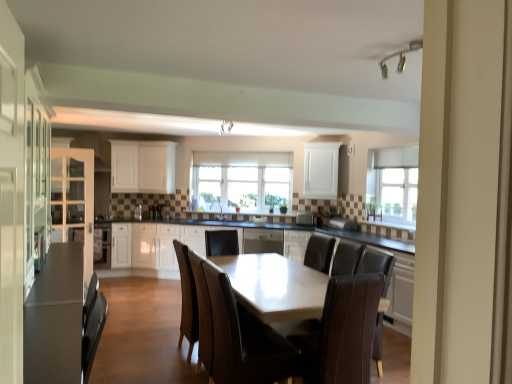
The height and width of the screenshot is (384, 512). What do you see at coordinates (124, 166) in the screenshot? I see `white matte cabinet at center, acting as the 4th cabinetry starting from the right` at bounding box center [124, 166].

What is the approximate width of white glossy cabinet at center, placed as the 2th cabinetry when sorted from right to left?

It is 24.98 inches.

The image size is (512, 384). What do you see at coordinates (228, 328) in the screenshot? I see `matte white table at center` at bounding box center [228, 328].

Measure the distance between matte white table at center and camera.

The distance of matte white table at center from camera is 2.64 meters.

Describe the element at coordinates (305, 219) in the screenshot. I see `matte gray armchair at center` at that location.

This screenshot has height=384, width=512. Describe the element at coordinates (163, 211) in the screenshot. I see `satin silver toaster at center, the first appliance in the right-to-left sequence` at that location.

This screenshot has height=384, width=512. In order to click on white matte cabinet at upper center, the 5th cabinetry positioned from the left in this screenshot , I will do `click(321, 170)`.

From the picture: How different are the orientations of clear glass window at center, arranged as the first window when viewed from the left, and matte gray armchair at center in degrees?

clear glass window at center, arranged as the first window when viewed from the left, and matte gray armchair at center are facing 3.33 degrees away from each other.

Could you tell me if clear glass window at center, acting as the first window starting from the back, is facing matte gray armchair at center?

No, clear glass window at center, acting as the first window starting from the back, is not aimed at matte gray armchair at center.

Which of these two, clear glass window at center, the 2th window in the right-to-left sequence, or matte gray armchair at center, is wider?

matte gray armchair at center.

Which of these two, clear glass window at center, acting as the first window starting from the back, or matte gray armchair at center, is bigger?

With larger size is clear glass window at center, acting as the first window starting from the back.

In the scene shown: From a real-world perspective, is matte gray armchair at center beneath clear glass window at upper center, the second window in the back-to-front sequence?

Yes, from a real-world perspective, matte gray armchair at center is below clear glass window at upper center, the second window in the back-to-front sequence.

From the picture: Are matte gray armchair at center and clear glass window at upper center, which ranks as the first window in right-to-left order, located far from each other?

That's right, there is a large distance between matte gray armchair at center and clear glass window at upper center, which ranks as the first window in right-to-left order.

Which object is positioned more to the left, matte gray armchair at center or clear glass window at upper center, the first window viewed from the front?

Positioned to the left is matte gray armchair at center.

In terms of size, does matte gray armchair at center appear bigger or smaller than clear glass window at upper center, which is counted as the 2th window, starting from the left?

Considering their sizes, matte gray armchair at center takes up less space than clear glass window at upper center, which is counted as the 2th window, starting from the left.

Based on their sizes in the image, would you say white matte cabinet at center, acting as the 4th cabinetry starting from the right, is bigger or smaller than brown leather chair at center, positioned as the 2th chair in left-to-right order?

white matte cabinet at center, acting as the 4th cabinetry starting from the right, is smaller than brown leather chair at center, positioned as the 2th chair in left-to-right order.

Is white matte cabinet at center, acting as the 4th cabinetry starting from the right, wider than brown leather chair at center, positioned as the 2th chair in left-to-right order?

In fact, white matte cabinet at center, acting as the 4th cabinetry starting from the right, might be narrower than brown leather chair at center, positioned as the 2th chair in left-to-right order.

Looking at this image, which point is more forward, (125, 156) or (329, 352)?

Positioned in front is point (329, 352).

From the picture: Is satin silver dishwasher at center wider than white glossy cabinet at center, the 4th cabinetry from the left?

Yes.

Where is `dish washer located behind the white glossy cabinet at center, the 4th cabinetry from the left`? Image resolution: width=512 pixels, height=384 pixels. dish washer located behind the white glossy cabinet at center, the 4th cabinetry from the left is located at coordinates (263, 241).

In the image, is satin silver dishwasher at center positioned in front of or behind white glossy cabinet at center, the 4th cabinetry from the left?

Visually, satin silver dishwasher at center is located behind white glossy cabinet at center, the 4th cabinetry from the left.

Can you confirm if satin silver dishwasher at center is smaller than white glossy cabinet at center, placed as the 2th cabinetry when sorted from right to left?

Actually, satin silver dishwasher at center might be larger than white glossy cabinet at center, placed as the 2th cabinetry when sorted from right to left.

Is white glossy cabinet at center, placed as the 2th cabinetry when sorted from right to left, turned away from matte white cabinet at left, the first cabinetry from the left?

No, matte white cabinet at left, the first cabinetry from the left, is not at the back of white glossy cabinet at center, placed as the 2th cabinetry when sorted from right to left.

Relative to matte white cabinet at left, marked as the 5th cabinetry in a right-to-left arrangement, is white glossy cabinet at center, placed as the 2th cabinetry when sorted from right to left, in front or behind?

white glossy cabinet at center, placed as the 2th cabinetry when sorted from right to left, is positioned farther from the viewer than matte white cabinet at left, marked as the 5th cabinetry in a right-to-left arrangement.

From a real-world perspective, relative to matte white cabinet at left, the first cabinetry from the left, is white glossy cabinet at center, placed as the 2th cabinetry when sorted from right to left, vertically above or below?

Clearly, from a real-world perspective, white glossy cabinet at center, placed as the 2th cabinetry when sorted from right to left, is below matte white cabinet at left, the first cabinetry from the left.

Where is `cabinetry below the matte white cabinet at left, the first cabinetry from the left (from the image's perspective)`? The image size is (512, 384). cabinetry below the matte white cabinet at left, the first cabinetry from the left (from the image's perspective) is located at coordinates (296, 244).

Where is `the 2nd appliance behind the clear glass window at center, the 2th window in the right-to-left sequence`? This screenshot has width=512, height=384. the 2nd appliance behind the clear glass window at center, the 2th window in the right-to-left sequence is located at coordinates (163, 211).

Is point (268, 206) positioned behind point (168, 214)?

That is True.

Is clear glass window at center, the 2th window in the right-to-left sequence, next to satin silver toaster at center, which is the 2th appliance in left-to-right order, and touching it?

No.

Does clear glass window at center, acting as the first window starting from the back, turn towards satin silver toaster at center, which is the 2th appliance in left-to-right order?

No, clear glass window at center, acting as the first window starting from the back, is not oriented towards satin silver toaster at center, which is the 2th appliance in left-to-right order.

Would you say white matte cabinet at upper center, which is the third cabinetry from right to left, is inside or outside white matte cabinet at upper center, the first cabinetry in the right-to-left sequence?

white matte cabinet at upper center, which is the third cabinetry from right to left, is located beyond the bounds of white matte cabinet at upper center, the first cabinetry in the right-to-left sequence.

Which object is further away from the camera, white matte cabinet at upper center, which is the third cabinetry from right to left, or white matte cabinet at upper center, the first cabinetry in the right-to-left sequence?

white matte cabinet at upper center, which is the third cabinetry from right to left, is further from the camera.

Considering the relative positions of white matte cabinet at upper center, which is the third cabinetry from right to left, and white matte cabinet at upper center, the 5th cabinetry positioned from the left, in the image provided, is white matte cabinet at upper center, which is the third cabinetry from right to left, to the left or to the right of white matte cabinet at upper center, the 5th cabinetry positioned from the left,?

Clearly, white matte cabinet at upper center, which is the third cabinetry from right to left, is on the left of white matte cabinet at upper center, the 5th cabinetry positioned from the left, in the image.

The image size is (512, 384). I want to click on window located on the left of matte gray armchair at center, so click(x=242, y=180).

From the image's perspective, starting from the matte gray armchair at center, which window is the 2nd one above? Please provide its 2D coordinates.

[(392, 185)]

Considering their positions, is white matte cabinet at center, acting as the 4th cabinetry starting from the right, positioned further to matte gray armchair at center than satin silver dishwasher at center?

Based on the image, white matte cabinet at center, acting as the 4th cabinetry starting from the right, appears to be further to matte gray armchair at center.

Considering their positions, is matte white cabinet at left, the first cabinetry from the left, positioned closer to satin silver toaster at center, which is the 2th appliance in left-to-right order, than brown leather chair at center, which is the 1th chair in right-to-left order?

The object closer to satin silver toaster at center, which is the 2th appliance in left-to-right order, is matte white cabinet at left, the first cabinetry from the left.

Based on their spatial positions, is matte white table at center or satin silver toaster at center, the 1th appliance when ordered from left to right, further from clear glass window at center, the 2th window in the right-to-left sequence?

matte white table at center lies further to clear glass window at center, the 2th window in the right-to-left sequence, than the other object.

Based on their spatial positions, is clear glass window at upper center, the first window viewed from the front, or white glossy cabinet at center, placed as the 2th cabinetry when sorted from right to left, closer to satin silver dishwasher at center?

The object closer to satin silver dishwasher at center is white glossy cabinet at center, placed as the 2th cabinetry when sorted from right to left.

Considering their positions, is satin silver dishwasher at center positioned closer to satin silver toaster at center, marked as the 2th appliance in a right-to-left arrangement, than white matte cabinet at upper center, the 5th cabinetry positioned from the left?

satin silver dishwasher at center is closer to satin silver toaster at center, marked as the 2th appliance in a right-to-left arrangement.

Based on their spatial positions, is satin silver toaster at center, the first appliance in the right-to-left sequence, or clear glass window at upper center, the first window viewed from the front, further from white matte cabinet at upper center, which is the third cabinetry from right to left?

Based on the image, clear glass window at upper center, the first window viewed from the front, appears to be further to white matte cabinet at upper center, which is the third cabinetry from right to left.

Based on their spatial positions, is matte white cabinet at left, the first cabinetry from the left, or satin silver toaster at center, which is the 2th appliance in left-to-right order, further from matte white table at center?

satin silver toaster at center, which is the 2th appliance in left-to-right order, is further to matte white table at center.

Considering their positions, is brown leather chair at center, positioned as the 2th chair in left-to-right order, positioned further to white matte cabinet at center, which is the second cabinetry in left-to-right order, than matte white cabinet at left, marked as the 5th cabinetry in a right-to-left arrangement?

brown leather chair at center, positioned as the 2th chair in left-to-right order, is positioned further to the anchor white matte cabinet at center, which is the second cabinetry in left-to-right order.

This screenshot has height=384, width=512. In order to click on cabinetry between clear glass window at center, arranged as the first window when viewed from the left, and matte gray armchair at center, in the horizontal direction in this screenshot , I will do `click(296, 244)`.

The width and height of the screenshot is (512, 384). I want to click on dish washer located between matte white table at center and satin silver toaster at center, which is the 2th appliance in left-to-right order, in the depth direction, so click(x=263, y=241).

What are the coordinates of `sink located between satin silver toaster at center, which is the 2th appliance in left-to-right order, and matte gray armchair at center in the left-right direction` in the screenshot? It's located at (220, 214).

Locate an element on the screen. sink between brown leather chair at center, which is the 1th chair in right-to-left order, and satin silver toaster at center, which is the 2th appliance in left-to-right order, in the front-back direction is located at coordinates (220, 214).